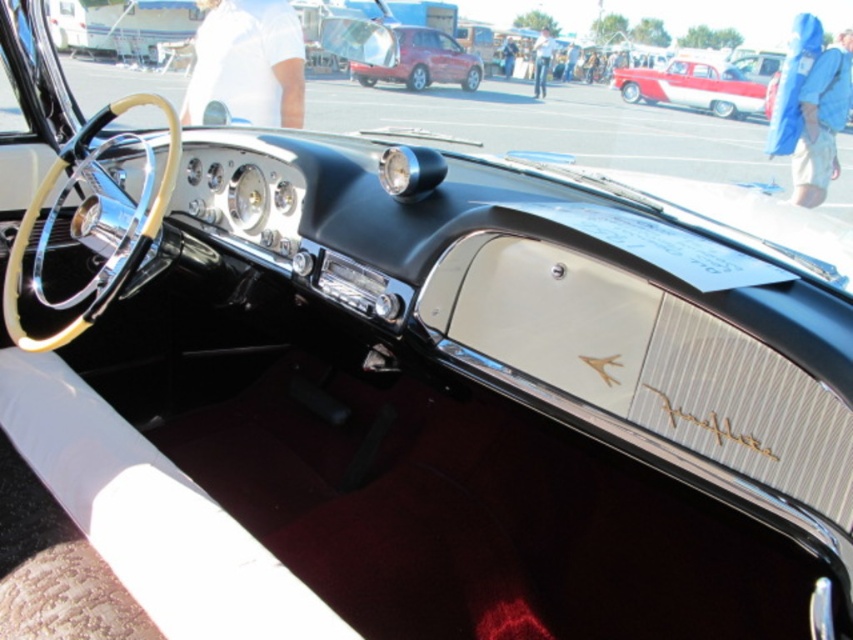
You are a delivery person trying to park your 14.00 meter long truck in a narrow alleyway. You see a white glossy sedan at center blocking your path. What should you do?

The white glossy sedan at center is 13.90 meters away from your truck. Since your truck is 14.00 meters long, which is slightly longer than the distance available, you should not attempt to park here and look for another space.

Based on the photo, you are standing in front of the vintage car and want to know how far the point at coordinates (689,74) is from you. Can you determine the distance?

The point at coordinates (689,74) is 15.70 meters away from the viewer.

You are a delivery person who needs to load a package onto a truck. The truck has a loading ramp that can only accommodate items up to 1.5 meters in height. You have two vehicles in front of you, a white glossy sedan at center and a metallic red suv at center. Which vehicle can you safely load the package onto without exceeding the height limit?

The white glossy sedan at center has a lesser height compared to the metallic red suv at center, so the package can be safely loaded onto the white glossy sedan at center as it meets the height requirement of 1.5 meters.